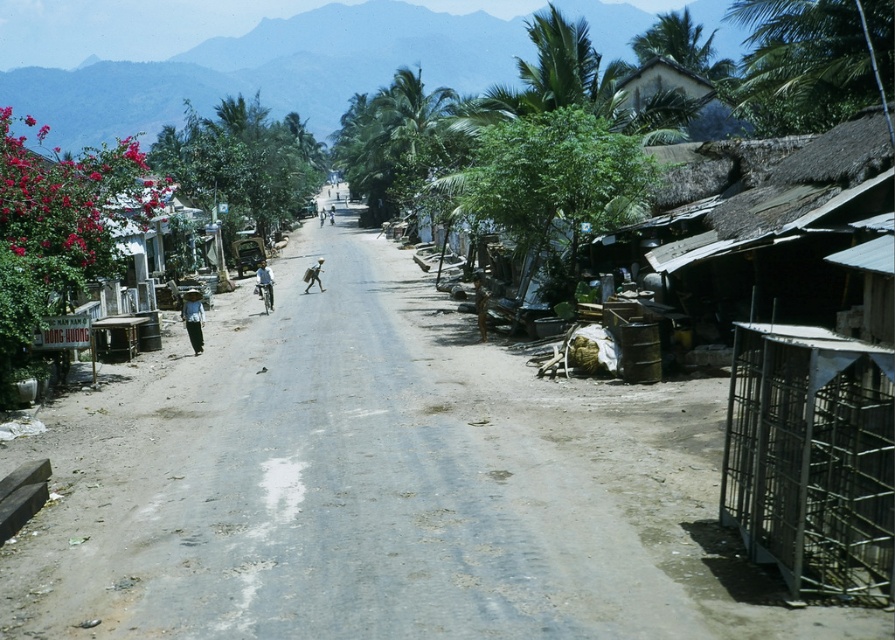
You are a traveler standing on the rural street scene. You see a dark blue fabric hat at center and a blue fabric shirt at center. How far apart are these two items?

The dark blue fabric hat at center and blue fabric shirt at center are 34.95 feet apart.

You are a traveler on this rural street and need to determine which item is shorter between the dark blue fabric hat at center and the light brown fabric bag at center. Which one is shorter?

The dark blue fabric hat at center is not as tall as the light brown fabric bag at center, so the dark blue fabric hat at center is shorter.